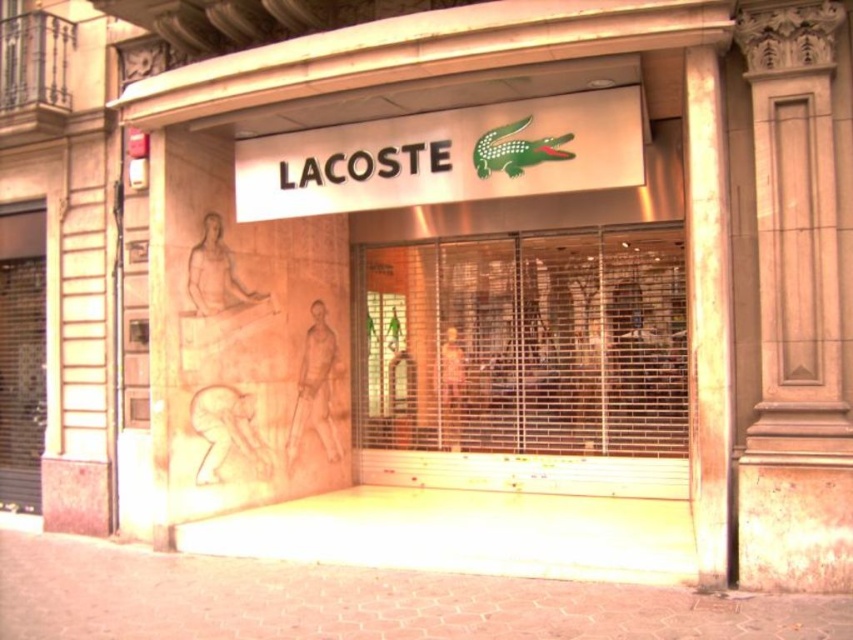
You are standing in front of the Lacoste store entrance. You need to locate the smooth stone pillar at right and the metallic gate at left. Which object is positioned to the right of the other?

The smooth stone pillar at right is positioned to the right of the metallic gate at left.

You are standing in front of the Lacoste store entrance. There is a smooth stone pillar at right located at point (706, 314). If you want to reach the entrance, which direction should you move relative to the smooth stone pillar at right?

The smooth stone pillar at right is located at point (706, 314). To reach the entrance, you should move towards the left relative to the smooth stone pillar at right since the entrance is to the left of the pillar.

You are a delivery person trying to hand over a package to the Lacoste store. You are standing outside the store and see the metallic glass at center and the white glossy sign at center. Which object is closer to you?

The metallic glass at center is closer to you because the white glossy sign at center is behind it.